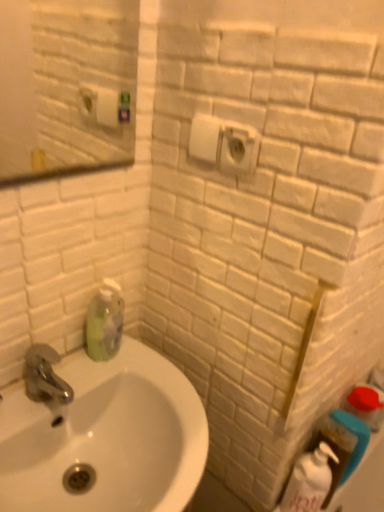
Image resolution: width=384 pixels, height=512 pixels. What are the coordinates of `vacant space in front of green matte bottle at lower left, the 2th cleaning product from the bottom` in the screenshot? It's located at (92, 388).